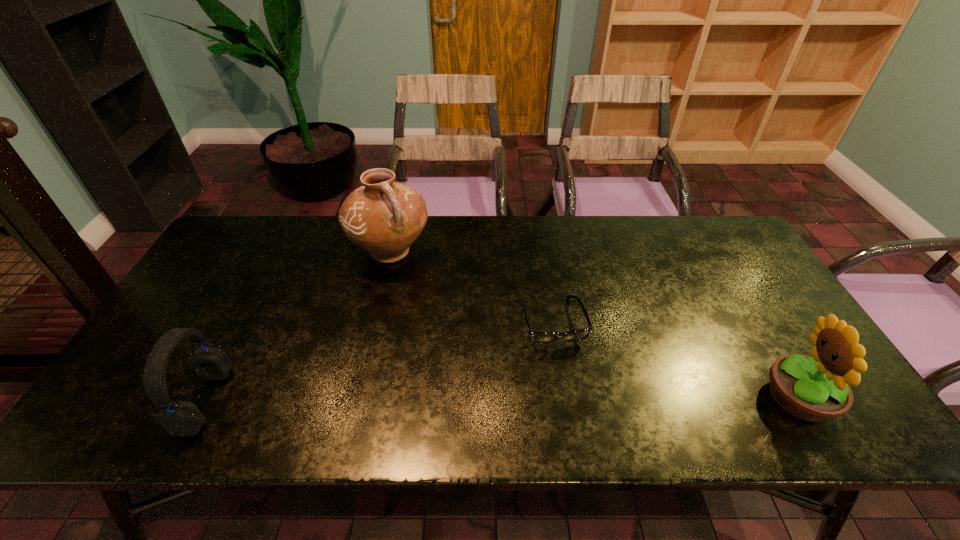
Identify the location of free spot at the far edge of the desktop. Image resolution: width=960 pixels, height=540 pixels. (447, 233).

The height and width of the screenshot is (540, 960). I want to click on free space at the near edge of the desktop, so click(x=473, y=392).

Where is `vacant space at the left edge`? vacant space at the left edge is located at coordinates tap(176, 322).

At what (x,y) coordinates should I click in order to perform the action: click on vacant space at the right edge of the desktop. Please return your answer as a coordinate pair (x, y). The width and height of the screenshot is (960, 540). Looking at the image, I should click on (726, 296).

The image size is (960, 540). I want to click on vacant space that is in between the rightmost object and the second object from left to right, so click(594, 325).

What are the coordinates of `vacant area that lies between the leftmost object and the rightmost object` in the screenshot? It's located at (501, 399).

Locate an element on the screen. This screenshot has height=540, width=960. vacant region between the sunflower and the third object from right to left is located at coordinates (594, 325).

Locate an element on the screen. This screenshot has width=960, height=540. vacant point located between the headset and the third object from right to left is located at coordinates (298, 326).

You are a GUI agent. You are given a task and a screenshot of the screen. Output one action in this format:
    pyautogui.click(x=<x>, y=<y>)
    Task: Click on the empty space between the third object from left to right and the farthest object
    This screenshot has height=540, width=960.
    Given the screenshot: What is the action you would take?
    pyautogui.click(x=471, y=287)

Where is `free space between the rightmost object and the second object from right to left`? free space between the rightmost object and the second object from right to left is located at coordinates (676, 360).